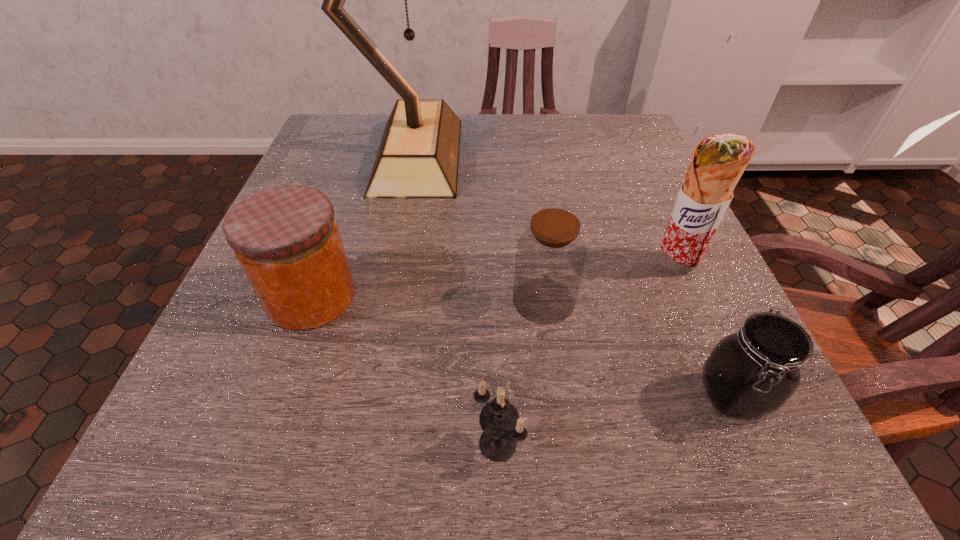
Where is `the farthest object`? This screenshot has height=540, width=960. the farthest object is located at coordinates (418, 157).

Identify the location of the tallest object. (418, 157).

This screenshot has height=540, width=960. I want to click on burrito, so click(718, 162).

The width and height of the screenshot is (960, 540). Identify the location of the leftmost jar. (286, 239).

The image size is (960, 540). I want to click on the fourth object from left to right, so click(x=550, y=256).

Find the location of a particular element. The image size is (960, 540). the nearest jar is located at coordinates (751, 373).

Locate an element on the screen. The height and width of the screenshot is (540, 960). the shortest jar is located at coordinates (751, 373).

Locate an element on the screen. This screenshot has height=540, width=960. candle holder is located at coordinates (502, 427).

This screenshot has width=960, height=540. What are the coordinates of `vacant region located 0.280m on the metallic stand of the farthest object` in the screenshot? It's located at (602, 155).

Identify the location of free spot located on the front of the fifth shortest object. (709, 341).